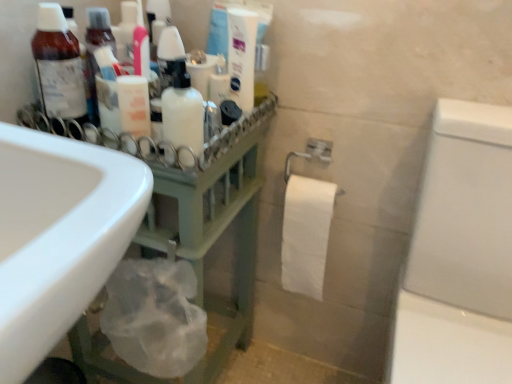
Question: From the image's perspective, would you say matte brown bottle at left is shown under white matte lotion at center?

Choices:
 (A) yes
 (B) no

Answer: (B)

Question: Is matte brown bottle at left behind white matte lotion at center?

Choices:
 (A) yes
 (B) no

Answer: (A)

Question: Is matte brown bottle at left to the left of white matte lotion at center from the viewer's perspective?

Choices:
 (A) yes
 (B) no

Answer: (A)

Question: From a real-world perspective, is matte brown bottle at left located higher than white matte lotion at center?

Choices:
 (A) yes
 (B) no

Answer: (A)

Question: Can you confirm if matte brown bottle at left is thinner than white matte lotion at center?

Choices:
 (A) no
 (B) yes

Answer: (A)

Question: Can you see matte brown bottle at left touching white matte lotion at center?

Choices:
 (A) no
 (B) yes

Answer: (A)

Question: Can green matte rack at left be found inside white matte lotion at center?

Choices:
 (A) yes
 (B) no

Answer: (B)

Question: Is white matte lotion at center positioned beyond the bounds of green matte rack at left?

Choices:
 (A) yes
 (B) no

Answer: (A)

Question: From a real-world perspective, does white matte lotion at center stand above green matte rack at left?

Choices:
 (A) yes
 (B) no

Answer: (A)

Question: Does white matte lotion at center turn towards green matte rack at left?

Choices:
 (A) no
 (B) yes

Answer: (A)

Question: Is white matte lotion at center shorter than green matte rack at left?

Choices:
 (A) yes
 (B) no

Answer: (A)

Question: Is white matte lotion at center smaller than green matte rack at left?

Choices:
 (A) no
 (B) yes

Answer: (B)

Question: From the image's perspective, would you say white glossy toothpaste tube at upper center is positioned over green matte rack at left?

Choices:
 (A) yes
 (B) no

Answer: (A)